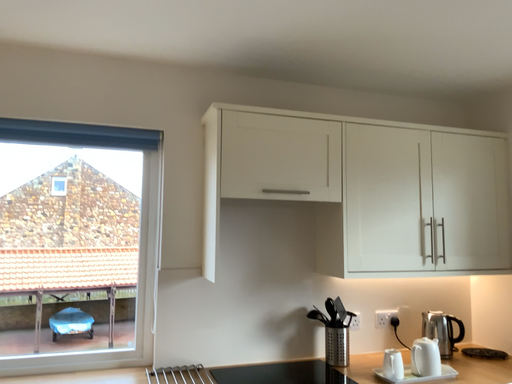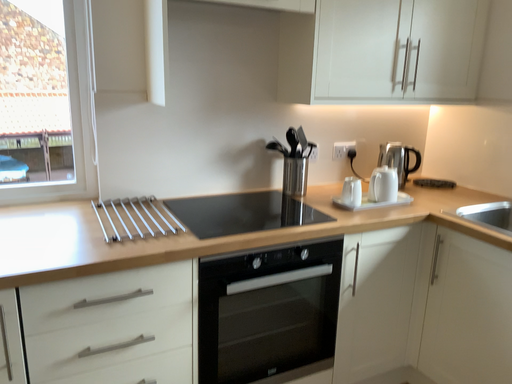
Question: Which way did the camera rotate in the video?

Choices:
 (A) rotated downward
 (B) rotated upward

Answer: (A)